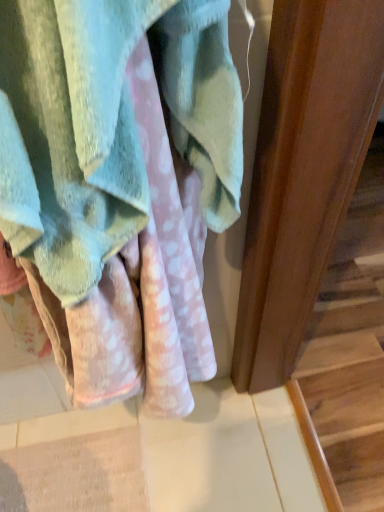
Question: Is point (339, 265) closer or farther from the camera than point (34, 99)?

Choices:
 (A) farther
 (B) closer

Answer: (A)

Question: From the image's perspective, relative to soft pink towel at center, is wooden at right above or below?

Choices:
 (A) above
 (B) below

Answer: (B)

Question: From a real-world perspective, is wooden at right positioned above or below soft pink towel at center?

Choices:
 (A) below
 (B) above

Answer: (A)

Question: Is soft pink towel at center wider or thinner than wooden at right?

Choices:
 (A) wide
 (B) thin

Answer: (B)

Question: Is soft pink towel at center to the left or to the right of wooden at right in the image?

Choices:
 (A) right
 (B) left

Answer: (B)

Question: Is point (238, 172) positioned closer to the camera than point (360, 305)?

Choices:
 (A) closer
 (B) farther

Answer: (A)

Question: Is soft pink towel at center inside or outside of wooden at right?

Choices:
 (A) inside
 (B) outside

Answer: (B)